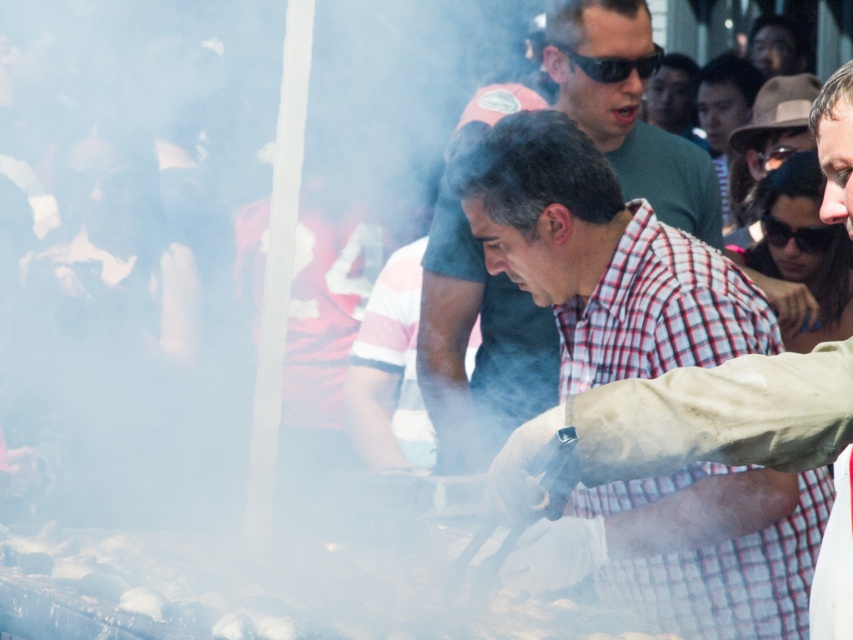
You are a photographer at the event and want to capture both the plaid cotton shirt at center and the black plastic sunglasses at upper right in a single frame. Which object should you focus on first to ensure both fit in the shot?

The plaid cotton shirt at center is larger in width than the black plastic sunglasses at upper right, so you should focus on the plaid cotton shirt at center first to ensure both fit in the shot.